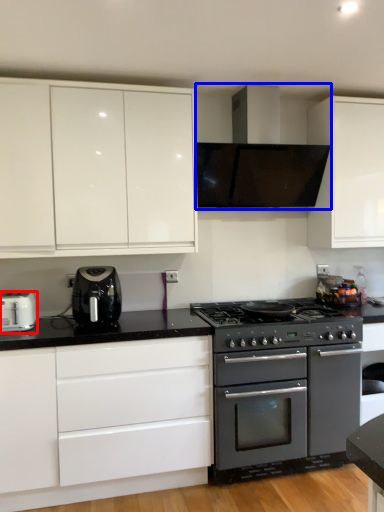
Question: Which of the following is the closest to the observer, toaster (highlighted by a red box) or home appliance (highlighted by a blue box)?

Choices:
 (A) toaster
 (B) home appliance

Answer: (A)